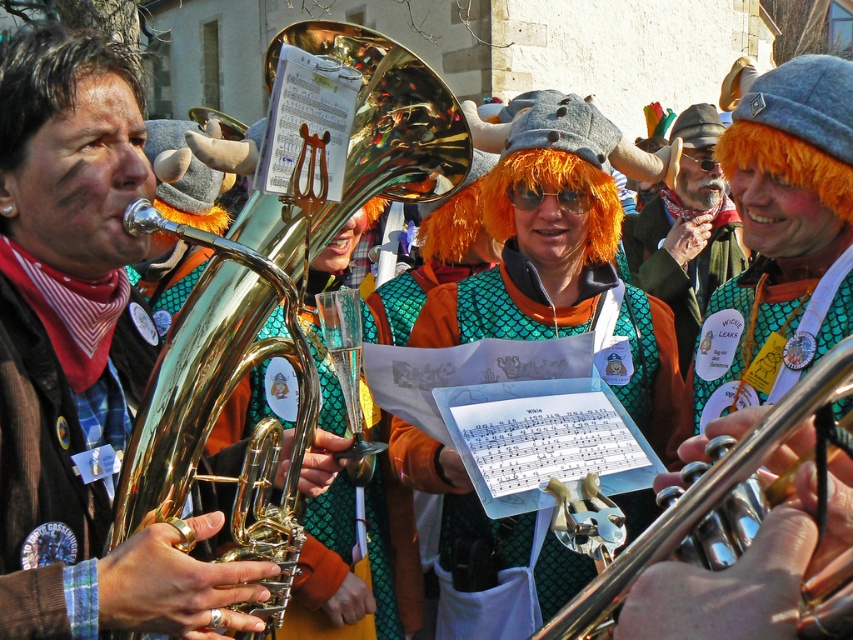
Is gold brass trumpet at left bigger than orange synthetic wig at upper right?

No.

How distant is gold brass trumpet at left from orange synthetic wig at upper right?

A distance of 8.00 meters exists between gold brass trumpet at left and orange synthetic wig at upper right.

Locate an element on the screen. Image resolution: width=853 pixels, height=640 pixels. gold brass trumpet at left is located at coordinates (192, 387).

At what (x,y) coordinates should I click in order to perform the action: click on gold brass trumpet at left. Please return your answer as a coordinate pair (x, y). The image size is (853, 640). Looking at the image, I should click on (192, 387).

Can you confirm if green mesh vest at center is positioned below orange synthetic wig at center?

Yes, green mesh vest at center is below orange synthetic wig at center.

Can you confirm if green mesh vest at center is thinner than orange synthetic wig at center?

Indeed, green mesh vest at center has a lesser width compared to orange synthetic wig at center.

Measure the distance between point (460,632) and camera.

Point (460,632) and camera are 73.32 feet apart.

Find the location of a particular element. green mesh vest at center is located at coordinates (486, 540).

Between silver metallic trumpet at center and orange synthetic wig at center, which one is positioned higher?

Positioned higher is orange synthetic wig at center.

Who is taller, silver metallic trumpet at center or orange synthetic wig at center?

Standing taller between the two is silver metallic trumpet at center.

Locate an element on the screen. This screenshot has height=640, width=853. silver metallic trumpet at center is located at coordinates (701, 496).